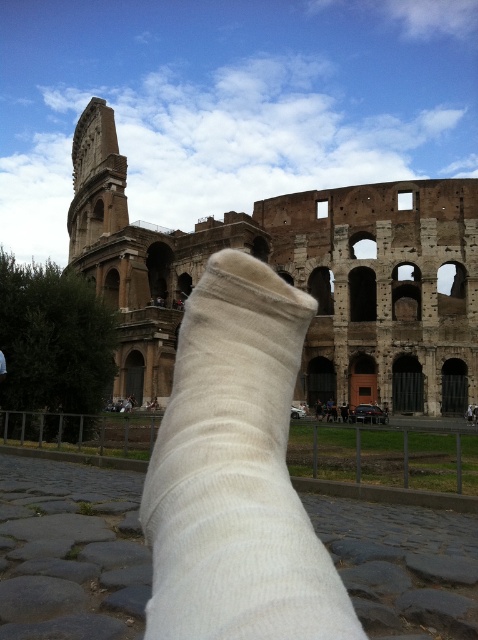
Question: Is brown stone amphitheater at center above white cotton sock at center?

Choices:
 (A) yes
 (B) no

Answer: (A)

Question: Is brown stone amphitheater at center bigger than white cotton sock at center?

Choices:
 (A) no
 (B) yes

Answer: (B)

Question: Which of the following is the closest to the observer?

Choices:
 (A) (177, 445)
 (B) (130, 276)

Answer: (A)

Question: In this image, where is brown stone amphitheater at center located relative to white cotton sock at center?

Choices:
 (A) below
 (B) above

Answer: (B)